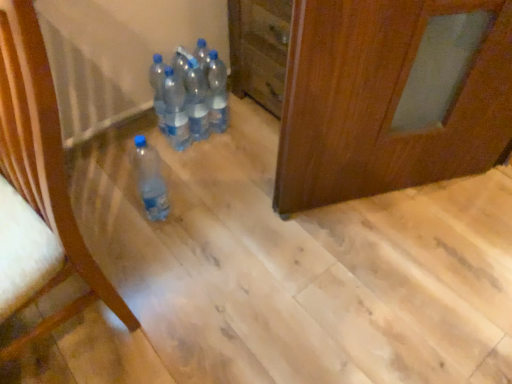
What are the coordinates of `vacant space in clear plastic bottle at left (from a real-world perspective)` in the screenshot? It's located at (71, 334).